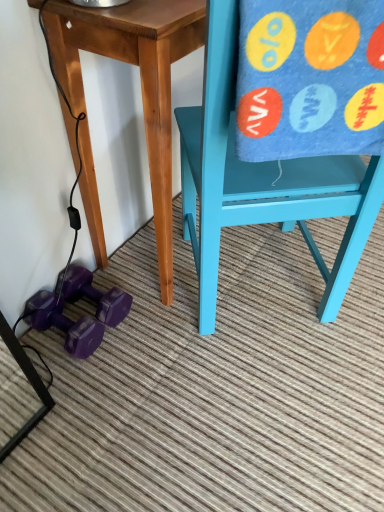
The image size is (384, 512). Find the location of `vacant area that lies to the right of purple rubber dumbbell at lower left, the second dumbbell in the top-to-bottom sequence`. vacant area that lies to the right of purple rubber dumbbell at lower left, the second dumbbell in the top-to-bottom sequence is located at coordinates (139, 342).